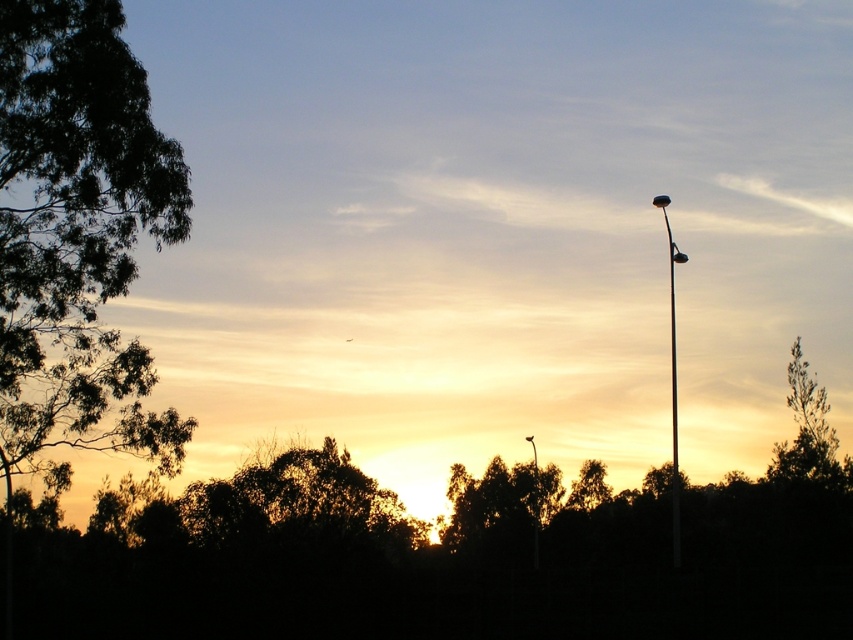
Question: Based on their relative distances, which object is farther from the metallic pole at right?

Choices:
 (A) green leafy tree at right
 (B) green leafy tree at left

Answer: (B)

Question: Which point is closer to the camera?

Choices:
 (A) green leafy tree at right
 (B) metallic pole at right

Answer: (B)

Question: Is green leafy tree at left positioned at the back of green leafy tree at right?

Choices:
 (A) no
 (B) yes

Answer: (A)

Question: Is the position of green leafy tree at right less distant than that of metallic pole at right?

Choices:
 (A) yes
 (B) no

Answer: (B)

Question: Among these objects, which one is nearest to the camera?

Choices:
 (A) green leafy tree at left
 (B) metallic pole at right
 (C) green leafy tree at right

Answer: (A)

Question: Can you confirm if green leafy tree at left is smaller than metallic pole at right?

Choices:
 (A) yes
 (B) no

Answer: (A)